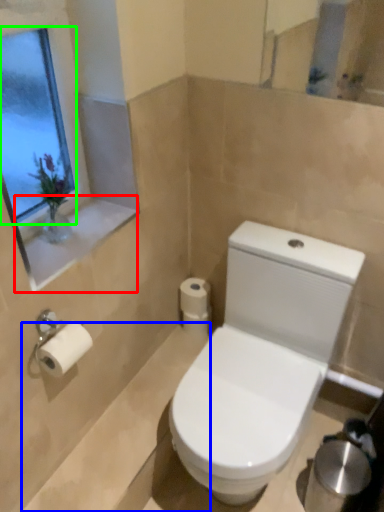
Question: Based on their relative distances, which object is nearer to window sill (highlighted by a red box)? Choose from bath (highlighted by a blue box) and window screen (highlighted by a green box).

Choices:
 (A) bath
 (B) window screen

Answer: (B)